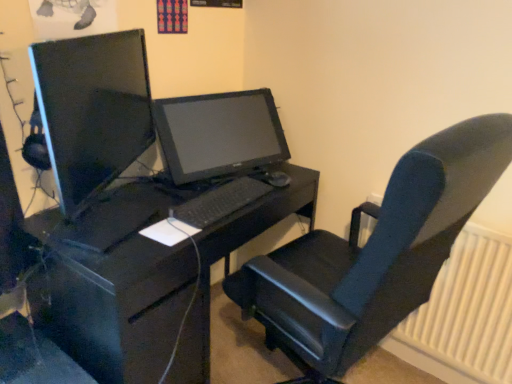
Where is `vacant space in black matte keyboard at center (from a real-world perspective)`? The height and width of the screenshot is (384, 512). vacant space in black matte keyboard at center (from a real-world perspective) is located at coordinates (212, 201).